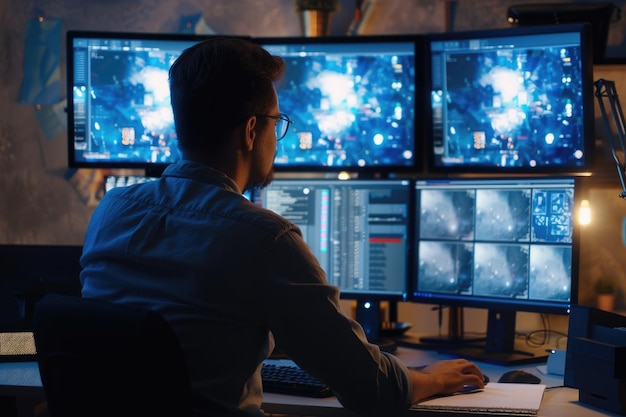
The height and width of the screenshot is (417, 626). Identify the location of computer screens. (341, 103), (141, 92), (111, 183), (357, 236), (495, 237).